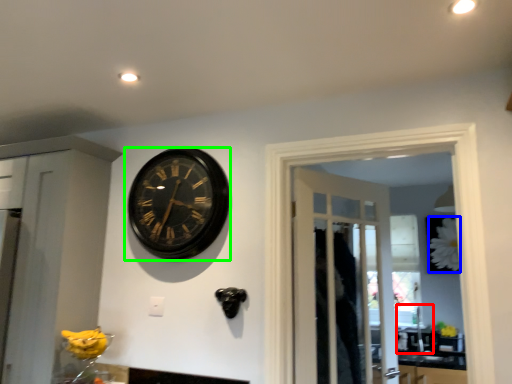
Question: Which object is positioned farthest from sink (highlighted by a red box)? Select from flower (highlighted by a blue box) and wall clock (highlighted by a green box).

Choices:
 (A) flower
 (B) wall clock

Answer: (B)